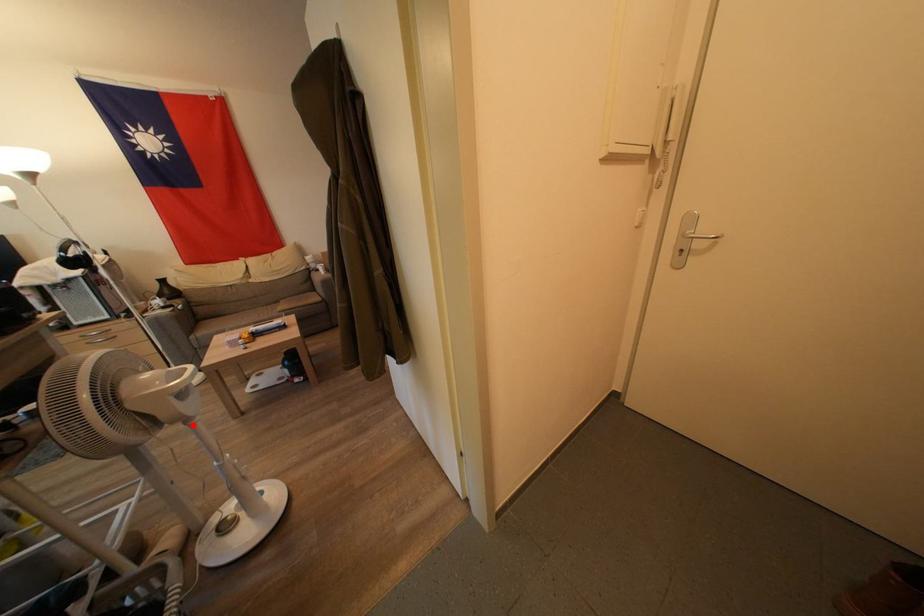
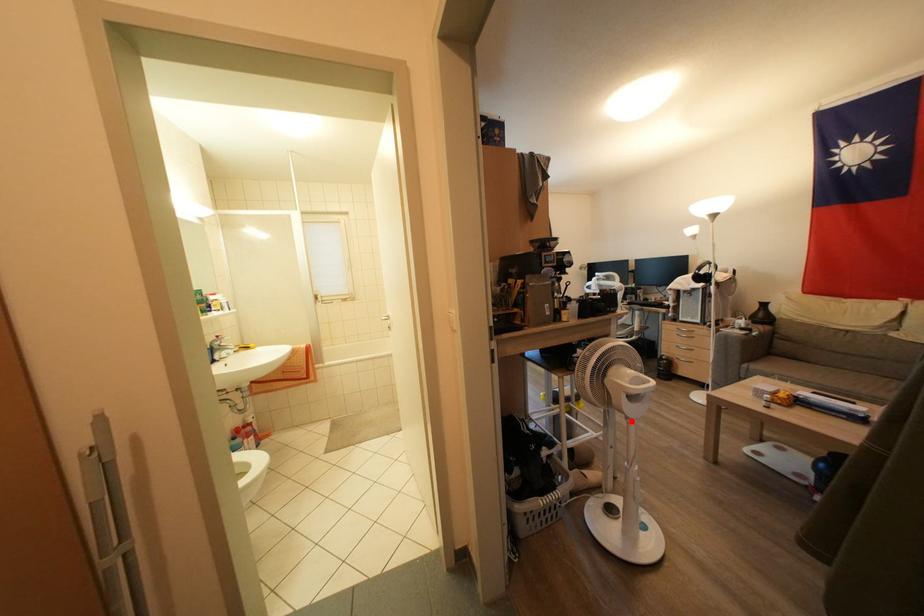
I am providing you with two images of the same scene from different viewpoints. A red point is marked on the first image and another point is marked on the second image. Does the point marked in image1 correspond to the same location as the one in image2?

Yes